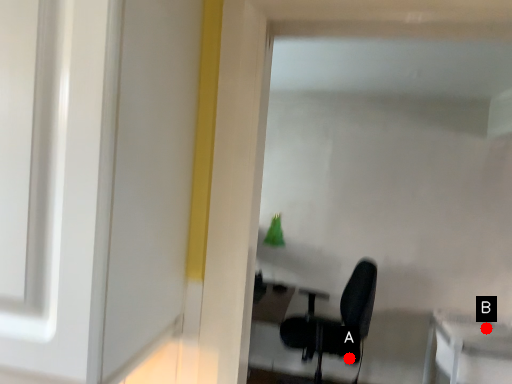
Question: Two points are circled on the image, labeled by A and B beside each circle. Which of the following is the farthest from the observer?

Choices:
 (A) A is further
 (B) B is further

Answer: (B)